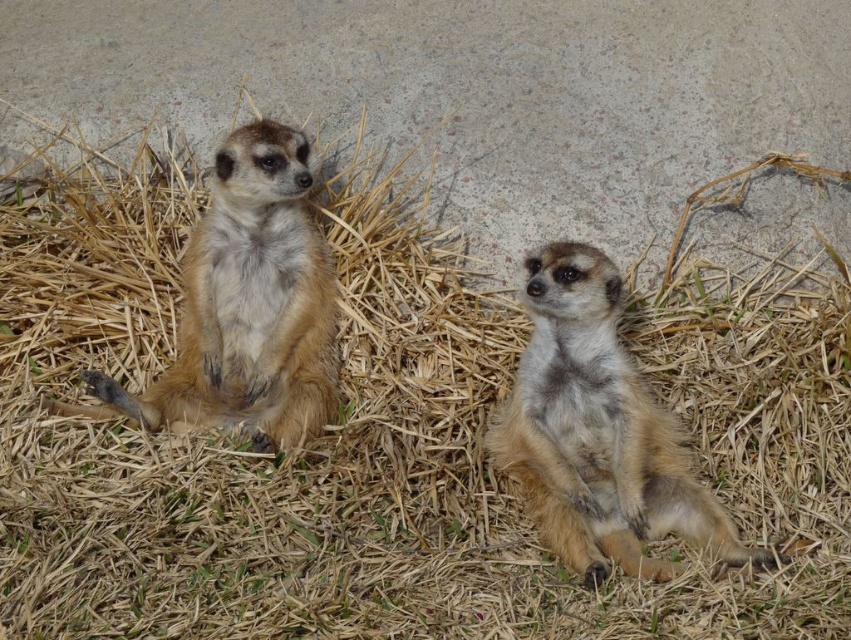
Question: Among these points, which one is farthest from the camera?

Choices:
 (A) (674, 429)
 (B) (240, 160)

Answer: (B)

Question: Is fuzzy brown meerkat at center further to camera compared to golden fur meerkat at left?

Choices:
 (A) no
 (B) yes

Answer: (A)

Question: Which point is closer to the camera?

Choices:
 (A) (204, 221)
 (B) (609, 349)

Answer: (B)

Question: Can you confirm if fuzzy brown meerkat at center is thinner than golden fur meerkat at left?

Choices:
 (A) yes
 (B) no

Answer: (A)

Question: Does fuzzy brown meerkat at center have a larger size compared to golden fur meerkat at left?

Choices:
 (A) yes
 (B) no

Answer: (B)

Question: Which of the following is the farthest from the observer?

Choices:
 (A) (307, 250)
 (B) (770, 563)

Answer: (A)